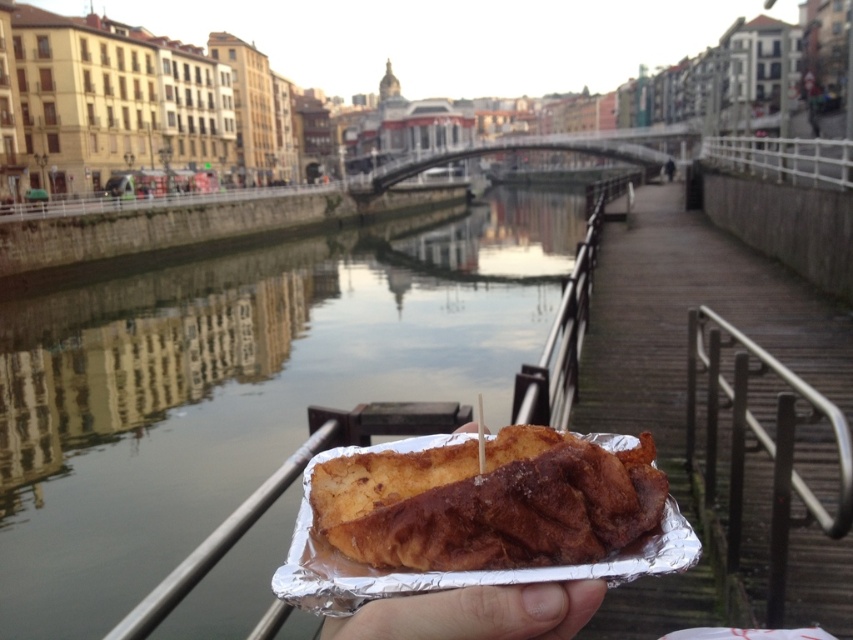
Can you confirm if glossy concrete water at center is smaller than golden-brown crispy pastry at center?

No, glossy concrete water at center is not smaller than golden-brown crispy pastry at center.

In the scene shown: Can you confirm if glossy concrete water at center is thinner than golden-brown crispy pastry at center?

No.

Where is `glossy concrete water at center`? glossy concrete water at center is located at coordinates (241, 385).

The width and height of the screenshot is (853, 640). I want to click on glossy concrete water at center, so click(241, 385).

Who is shorter, glossy concrete water at center or satin silver railing at lower right?

satin silver railing at lower right is shorter.

Can you confirm if glossy concrete water at center is taller than satin silver railing at lower right?

Indeed, glossy concrete water at center has a greater height compared to satin silver railing at lower right.

Measure the distance between point (x=473, y=272) and camera.

39.91 meters

Where is `glossy concrete water at center`? glossy concrete water at center is located at coordinates (241, 385).

Between golden-brown crispy pastry at center and satin silver railing at lower right, which one appears on the left side from the viewer's perspective?

golden-brown crispy pastry at center is more to the left.

The image size is (853, 640). Describe the element at coordinates (488, 502) in the screenshot. I see `golden-brown crispy pastry at center` at that location.

At what (x,y) coordinates should I click in order to perform the action: click on golden-brown crispy pastry at center. Please return your answer as a coordinate pair (x, y). Looking at the image, I should click on (488, 502).

Image resolution: width=853 pixels, height=640 pixels. In order to click on golden-brown crispy pastry at center in this screenshot , I will do `click(488, 502)`.